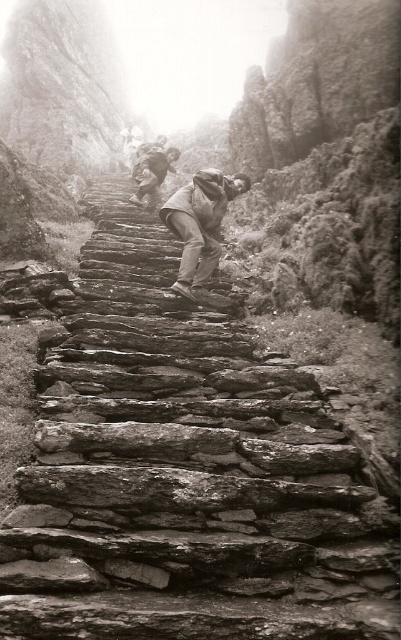
You are standing at the bottom of the stone staircase in the canyon. You see a rugged brown jacket at center and rugged stone steps at center. How far apart are these two objects?

The rugged brown jacket at center is 4.12 meters away from the rugged stone steps at center.